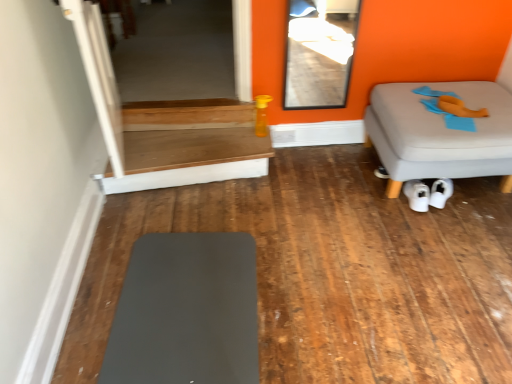
The height and width of the screenshot is (384, 512). What are the coordinates of `free space to the left of white matte sneakers at lower center` in the screenshot? It's located at (384, 201).